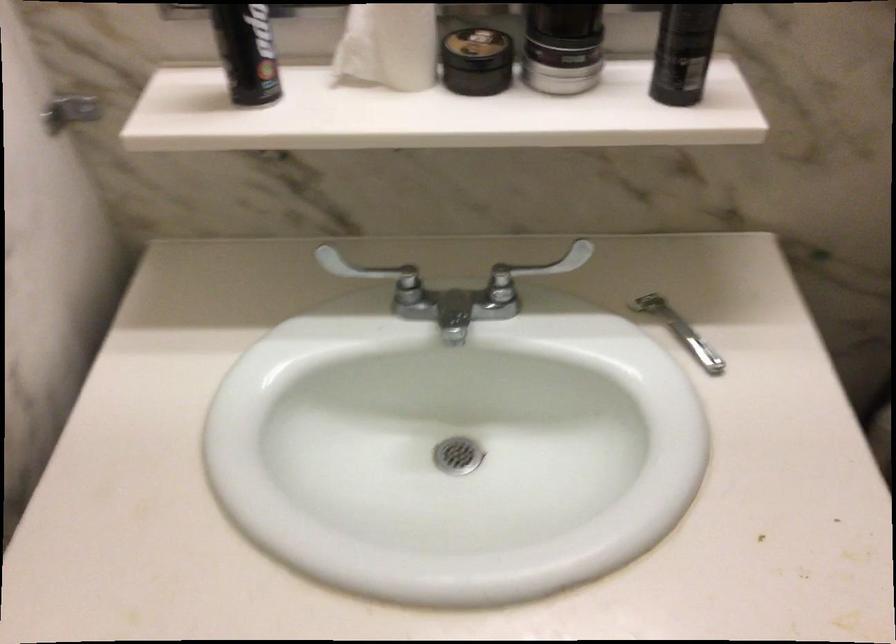
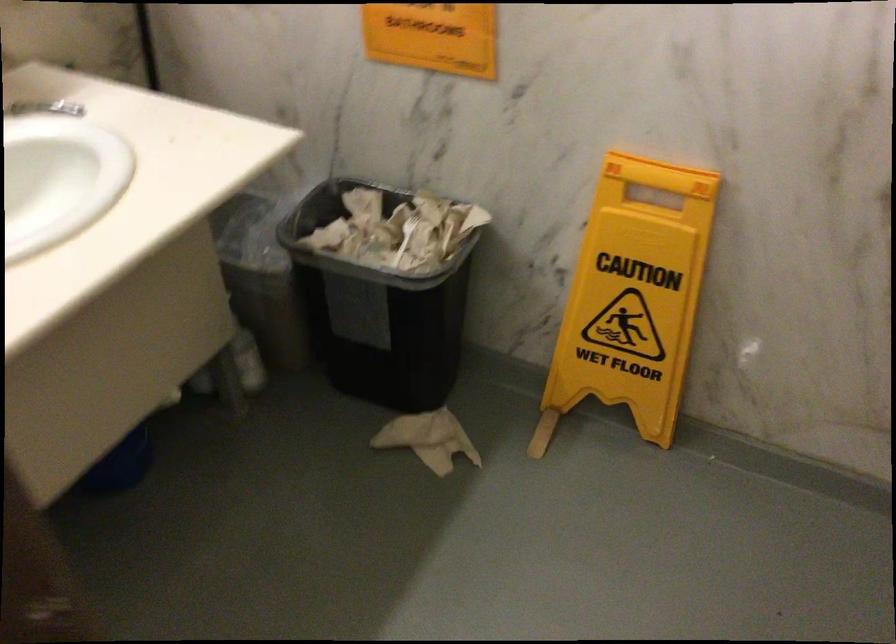
Question: The first image is from the beginning of the video and the second image is from the end. How did the camera likely rotate when shooting the video?

Choices:
 (A) Left
 (B) Right
 (C) Up
 (D) Down

Answer: (B)